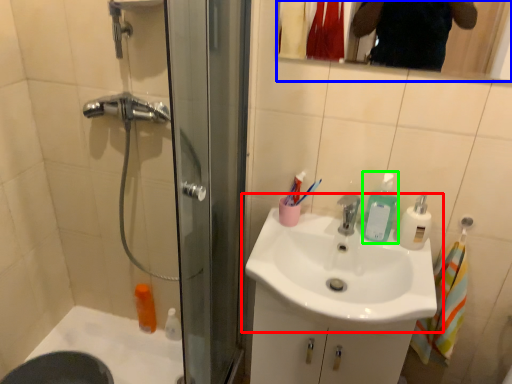
Question: Which is nearer to the sink (highlighted by a red box)? mirror (highlighted by a blue box) or soap dispenser (highlighted by a green box).

Choices:
 (A) mirror
 (B) soap dispenser

Answer: (B)